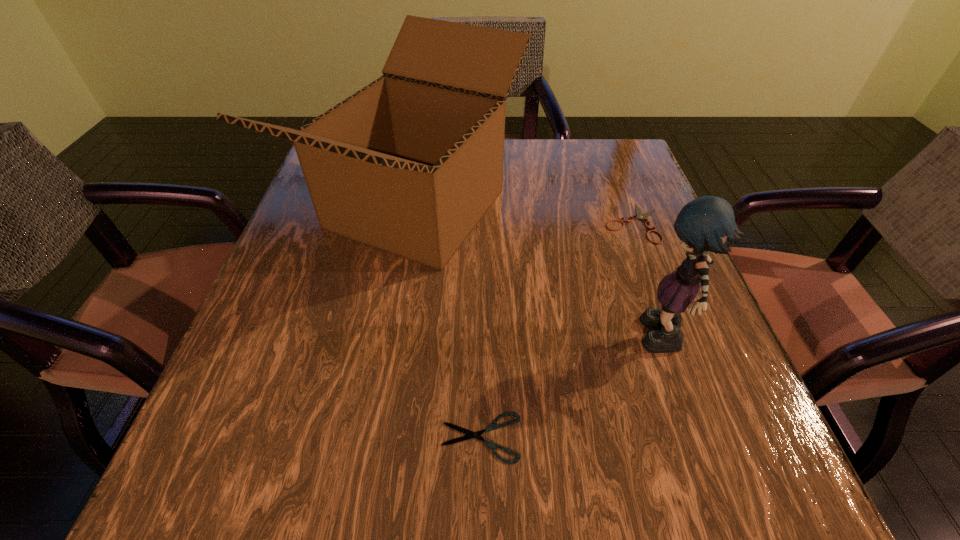
Where is `vacant point located 0.100m on the front of the taller shears`? Image resolution: width=960 pixels, height=540 pixels. vacant point located 0.100m on the front of the taller shears is located at coordinates (656, 281).

In order to click on vacant space located 0.280m on the back of the shorter shears in this screenshot , I will do `click(481, 274)`.

The width and height of the screenshot is (960, 540). I want to click on object located at the far edge, so click(x=409, y=164).

At what (x,y) coordinates should I click in order to perform the action: click on object present at the near edge. Please return your answer as a coordinate pair (x, y). This screenshot has width=960, height=540. Looking at the image, I should click on (470, 434).

I want to click on object positioned at the left edge, so click(409, 164).

This screenshot has height=540, width=960. In order to click on rag doll that is at the right edge in this screenshot , I will do `click(707, 223)`.

Image resolution: width=960 pixels, height=540 pixels. I want to click on shears present at the right edge, so click(641, 216).

At what (x,y) coordinates should I click in order to perform the action: click on object situated at the far left corner. Please return your answer as a coordinate pair (x, y). This screenshot has height=540, width=960. Looking at the image, I should click on (409, 164).

This screenshot has height=540, width=960. What are the coordinates of `free space at the far edge of the desktop` in the screenshot? It's located at (519, 168).

In the image, there is a desktop. Where is `vacant space at the near edge`? vacant space at the near edge is located at coordinates pos(613,472).